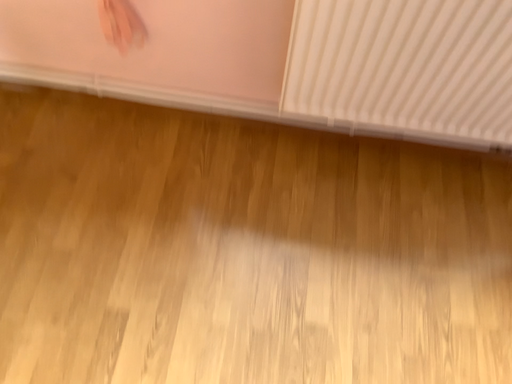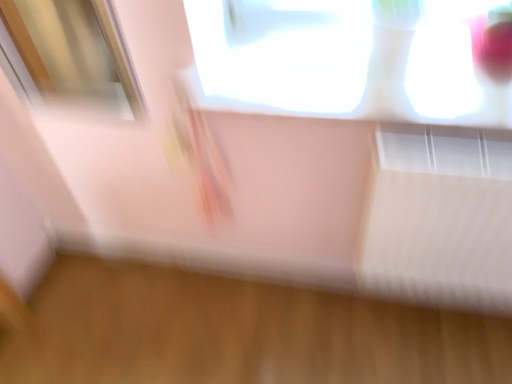
Question: Which way did the camera rotate in the video?

Choices:
 (A) rotated left
 (B) rotated right

Answer: (A)